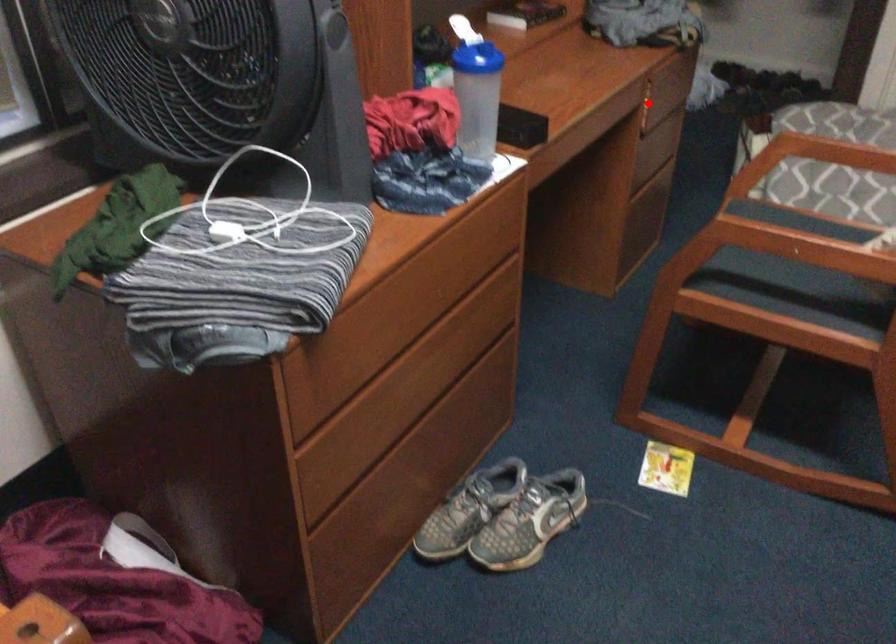
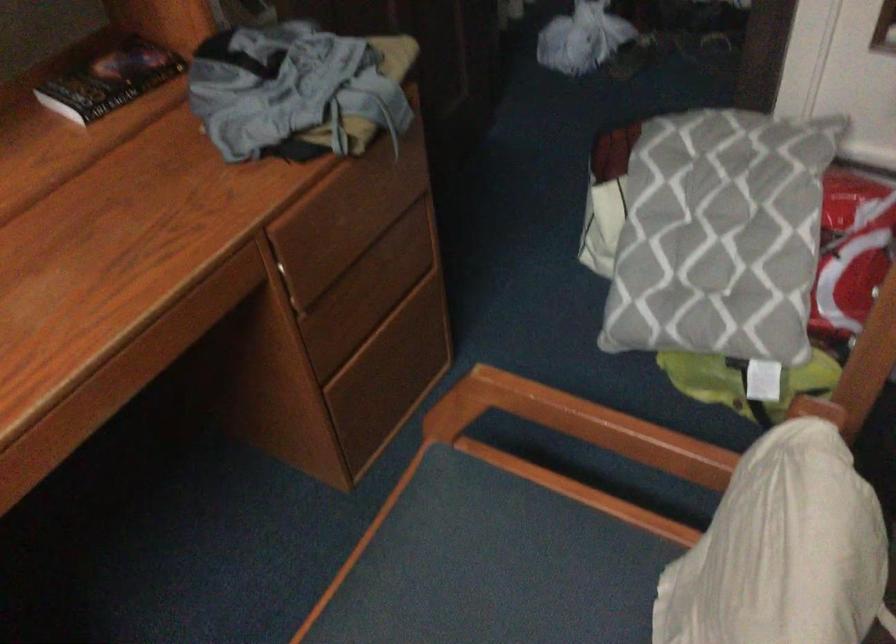
Find the pixel in the second image that matches the highlighted location in the first image.

(299, 276)